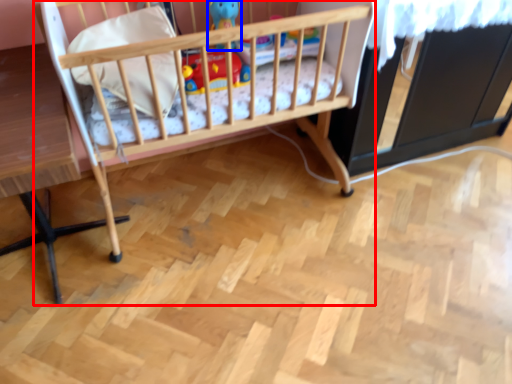
Question: Which of the following is the closest to the observer, infant bed (highlighted by a red box) or toy (highlighted by a blue box)?

Choices:
 (A) infant bed
 (B) toy

Answer: (A)